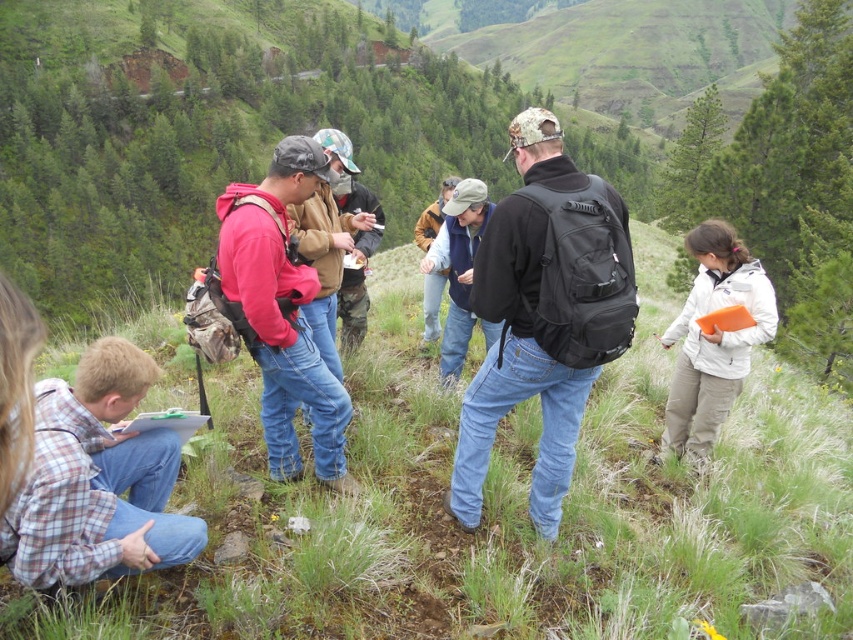
Is point (164, 461) closer to viewer compared to point (453, 280)?

Yes, point (164, 461) is in front of point (453, 280).

Is plaid cotton shirt at lower left wider than denim jacket at center?

Yes, plaid cotton shirt at lower left is wider than denim jacket at center.

Does point (180, 541) come behind point (450, 305)?

That is False.

Where is `plaid cotton shirt at lower left`? plaid cotton shirt at lower left is located at coordinates (97, 480).

Does plaid cotton shirt at lower left have a lesser width compared to matte brown jacket at center?

No, plaid cotton shirt at lower left is not thinner than matte brown jacket at center.

Does point (18, 525) come behind point (438, 225)?

No, it is in front of (438, 225).

Where is `plaid cotton shirt at lower left`? Image resolution: width=853 pixels, height=640 pixels. plaid cotton shirt at lower left is located at coordinates (97, 480).

Is black matte backpack at center below plaid cotton shirt at lower left?

No, black matte backpack at center is not below plaid cotton shirt at lower left.

This screenshot has width=853, height=640. In order to click on black matte backpack at center in this screenshot , I will do `click(543, 314)`.

Between point (526, 243) and point (140, 387), which one is positioned behind?

Positioned behind is point (526, 243).

At what (x,y) coordinates should I click in order to perform the action: click on black matte backpack at center. Please return your answer as a coordinate pair (x, y). This screenshot has width=853, height=640. Looking at the image, I should click on (543, 314).